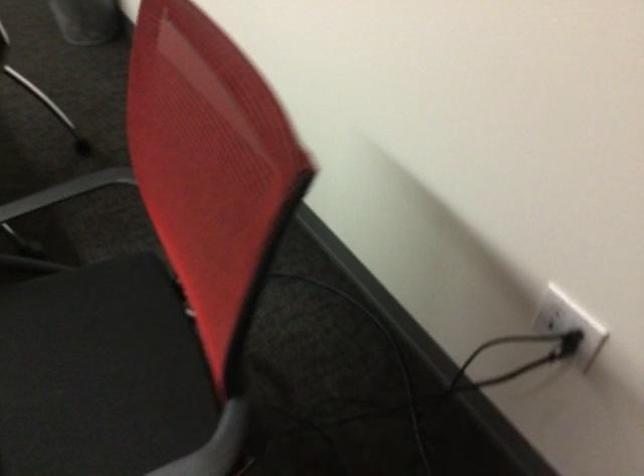
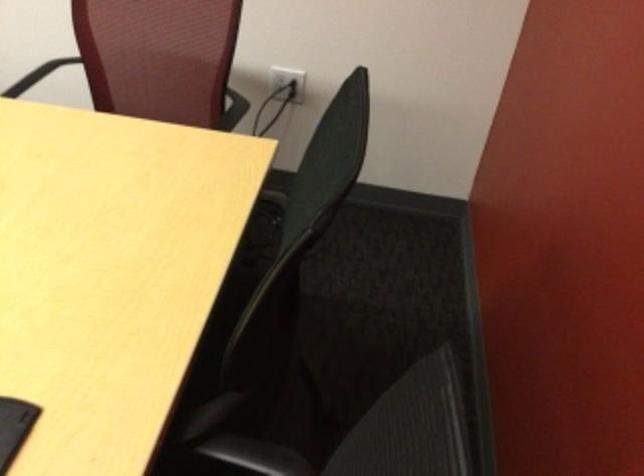
Question: I am providing you with two images of the same scene from different viewpoints. Please identify which objects are invisible in image2.

Choices:
 (A) chair armrest
 (B) chair sitting surface
 (C) black chair armrest
 (D) candy cane ornament

Answer: (A)